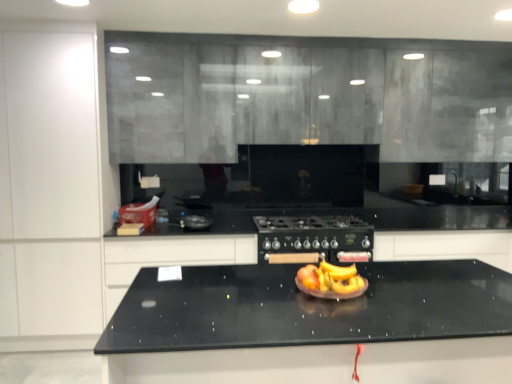
Question: In terms of width, does black matte gas stove at center look wider or thinner when compared to white matte cabinet at left, which ranks as the 1th cabinetry in left-to-right order?

Choices:
 (A) wide
 (B) thin

Answer: (A)

Question: Is black matte gas stove at center inside the boundaries of white matte cabinet at left, which ranks as the 1th cabinetry in left-to-right order, or outside?

Choices:
 (A) inside
 (B) outside

Answer: (B)

Question: Estimate the real-world distances between objects in this image. Which object is closer to the black matte cabinet at center, the first cabinetry in the right-to-left sequence?

Choices:
 (A) black granite countertop at center
 (B) shiny plastic fruit bowl at center
 (C) black matte gas stove at center
 (D) white matte cabinet at left, which ranks as the 1th cabinetry in left-to-right order
 (E) black granite countertop at center, which is counted as the third cabinetry, starting from the right

Answer: (C)

Question: Considering the real-world distances, which object is closest to the matte gray cabinetry at upper center, marked as the 3th cabinetry in a left-to-right arrangement?

Choices:
 (A) white matte cabinet at left, the fourth cabinetry viewed from the right
 (B) shiny plastic fruit bowl at center
 (C) black granite countertop at center, which is counted as the third cabinetry, starting from the right
 (D) black matte gas stove at center
 (E) black granite countertop at center

Answer: (D)